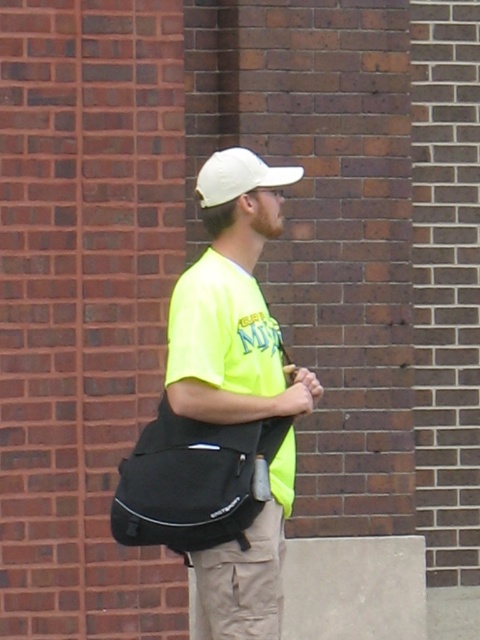
Does black fabric messenger bag at center appear on the right side of khaki cotton pants at lower center?

Incorrect, black fabric messenger bag at center is not on the right side of khaki cotton pants at lower center.

Does black fabric messenger bag at center have a smaller size compared to khaki cotton pants at lower center?

No.

Locate an element on the screen. Image resolution: width=480 pixels, height=640 pixels. black fabric messenger bag at center is located at coordinates (193, 481).

At what (x,y) coordinates should I click in order to perform the action: click on black fabric messenger bag at center. Please return your answer as a coordinate pair (x, y). Looking at the image, I should click on pos(193,481).

Who is lower down, black fabric messenger bag at center or white matte baseball cap at center?

black fabric messenger bag at center

The width and height of the screenshot is (480, 640). Describe the element at coordinates (193, 481) in the screenshot. I see `black fabric messenger bag at center` at that location.

What do you see at coordinates (193, 481) in the screenshot? The image size is (480, 640). I see `black fabric messenger bag at center` at bounding box center [193, 481].

Locate an element on the screen. This screenshot has height=640, width=480. black fabric messenger bag at center is located at coordinates (193, 481).

Is point (191, 570) closer to camera compared to point (203, 180)?

No, it is not.

Is khaki cotton pants at lower center smaller than white matte baseball cap at center?

Incorrect, khaki cotton pants at lower center is not smaller in size than white matte baseball cap at center.

This screenshot has height=640, width=480. Identify the location of khaki cotton pants at lower center. (240, 582).